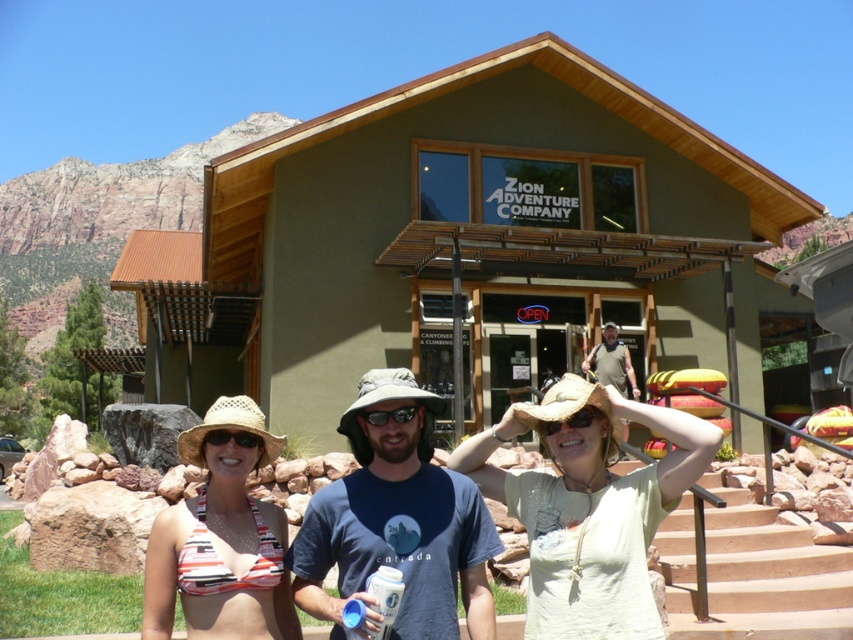
Question: Which point is closer to the camera?

Choices:
 (A) straw woven cowboy hat at center
 (B) white cotton bikini top at center

Answer: (A)

Question: Considering the relative positions of smooth concrete stairs at center and brown fabric cowboy hat at center in the image provided, where is smooth concrete stairs at center located with respect to brown fabric cowboy hat at center?

Choices:
 (A) right
 (B) left

Answer: (A)

Question: Which of the following is the closest to the observer?

Choices:
 (A) (657, 616)
 (B) (254, 444)
 (C) (187, 612)
 (D) (592, 440)

Answer: (A)

Question: Considering the relative positions of light beige straw hat at center and striped fabric bikini top at center in the image provided, where is light beige straw hat at center located with respect to striped fabric bikini top at center?

Choices:
 (A) left
 (B) right

Answer: (B)

Question: Which is farther from the light beige straw hat at center?

Choices:
 (A) white cotton bikini top at center
 (B) transparent plastic goggles at center
 (C) brown fabric cowboy hat at center

Answer: (C)

Question: Can you confirm if straw woven cowboy hat at center is thinner than transparent plastic goggles at center?

Choices:
 (A) no
 (B) yes

Answer: (A)